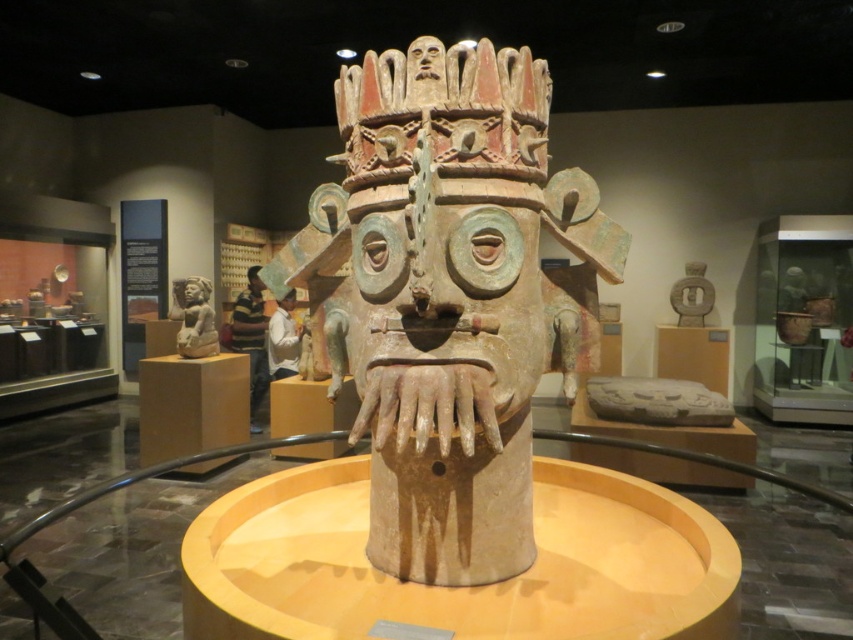
You are an artist standing in front of the museum exhibit. You want to paint a portrait of the sculpture. Which object, the matte clay mask at center or the white matte shirt at center, should you focus on first if you want to capture the tallest part of the sculpture?

The matte clay mask at center is taller than the white matte shirt at center, so you should focus on the matte clay mask at center first to capture the tallest part of the sculpture.

You are an artist who wants to create a miniature version of the museum exhibit. The white matte shirt at center is 20 cm wide. What should be the minimum width of the matte clay mask at center to maintain the correct proportions?

The matte clay mask at center is wider than the white matte shirt at center. Since the white matte shirt at center is 20 cm wide, the matte clay mask at center must be wider than 20 cm to maintain the correct proportions.

You are a fashion designer observing two shirts displayed at a museum exhibit. The shirts are the striped shirt at center and the white matte shirt at center. Which shirt is positioned lower in the display?

The striped shirt at center is below the white matte shirt at center, so it is positioned lower in the display.